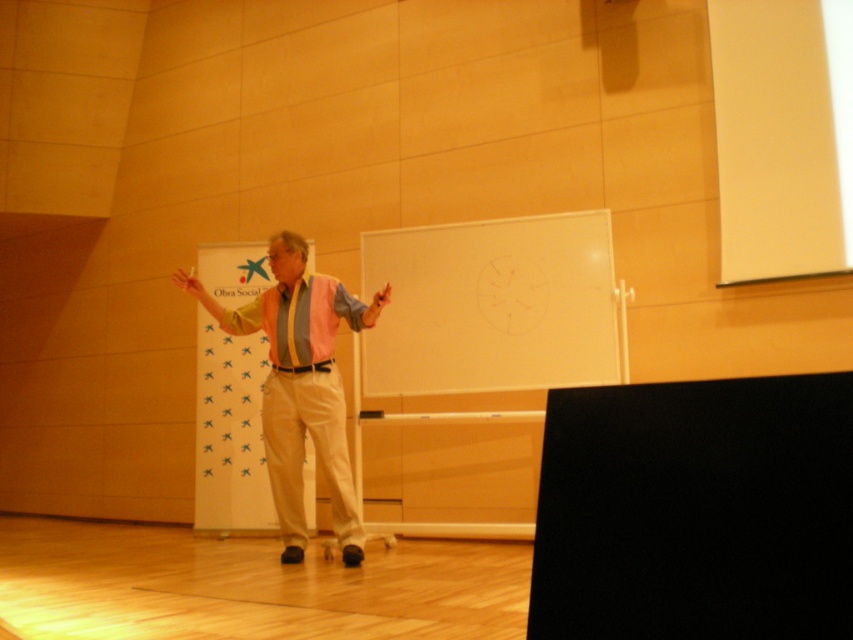
What is the relationship in height between the white matte projection screen at upper right and the pink fabric shirt at center?

The white matte projection screen at upper right is not as tall as the pink fabric shirt at center.

You are an attendee at the conference. You want to take a photo of the speaker and the banner. The banner is on the left side of the whiteboard. Where should you stand to ensure both the pink fabric shirt at center and the white matte projection screen at upper right are in the frame?

To capture both the pink fabric shirt at center and the white matte projection screen at upper right in your photo, you should position yourself to the right of the speaker so that the white matte projection screen at upper right is visible on the right side of the frame and the pink fabric shirt at center is centered. Since the white matte projection screen at upper right is to the right of the pink fabric shirt at center, this positioning ensures both elements are included in the shot.